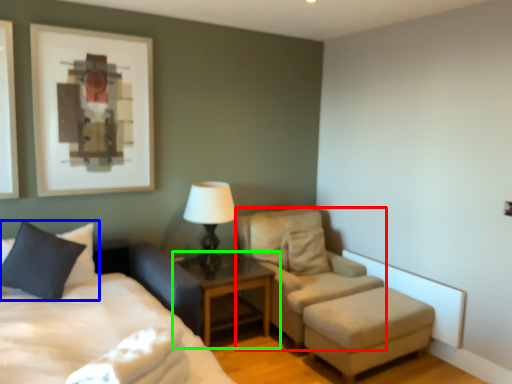
Question: Estimate the real-world distances between objects in this image. Which object is farther from chair (highlighted by a red box), pillow (highlighted by a blue box) or nightstand (highlighted by a green box)?

Choices:
 (A) pillow
 (B) nightstand

Answer: (A)